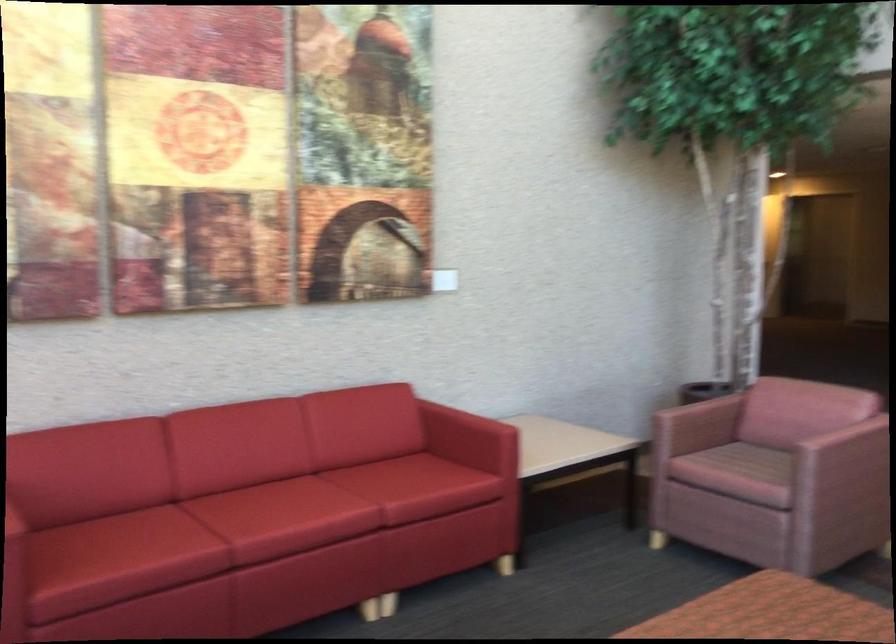
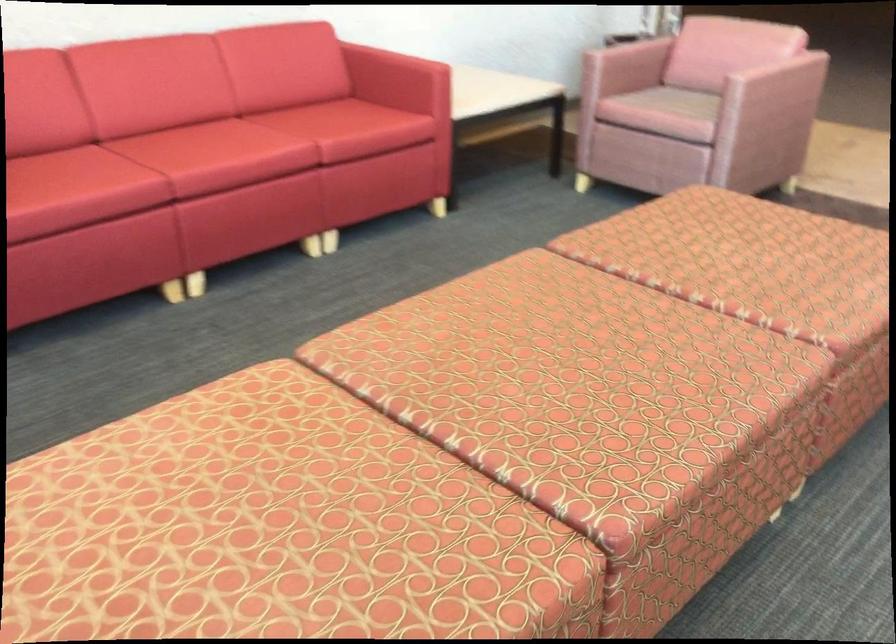
The point at (x=767, y=460) is marked in the first image. Where is the corresponding point in the second image?

(686, 102)